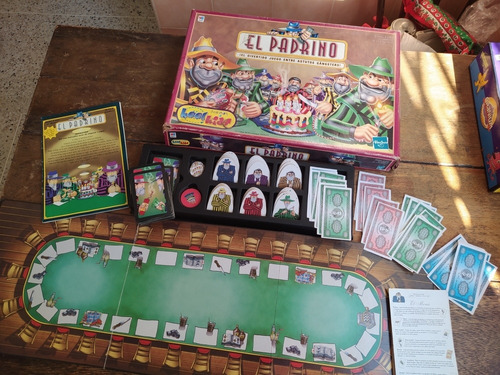
In order to click on table in this screenshot , I will do `click(435, 136)`.